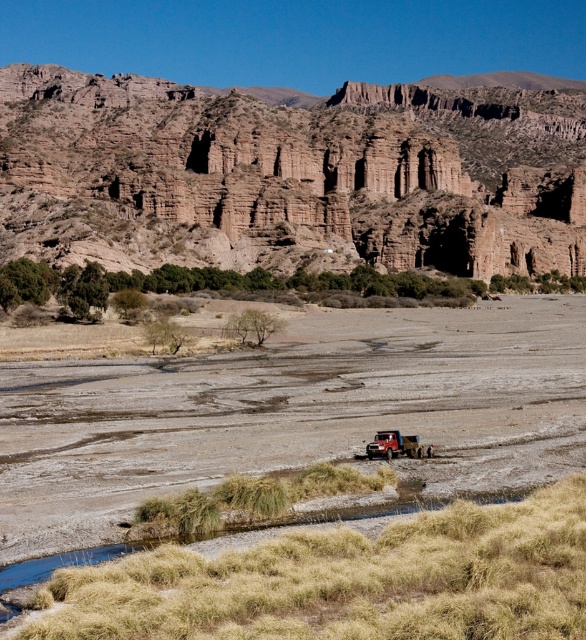
You are a hiker planning to cross the brown sandy dirt field at center. You notice the brown rock formation at upper center in the distance. Considering their sizes, which object would be more challenging to navigate and why?

The brown rock formation at upper center would be more challenging to navigate because it has a larger size compared to the brown sandy dirt field at center.

You are a delivery driver who needs to transport a 50 foot long cargo container from the brushed metal truck at center to the brown sandy dirt field at center. Can the cargo container fit between them without overlapping?

The distance between the brown sandy dirt field at center and the brushed metal truck at center is 60.69 feet. Since the cargo container is 50 feet long, it can fit within the space between them without overlapping.

You are planning a road trip and need to navigate through the arid landscape shown. Your vehicle is the brushed metal truck at center. There is a brown rock formation at upper center that you must pass. Can your truck safely maneuver around the rock formation without getting stuck?

The brown rock formation at upper center might be wider than the brushed metal truck at center, so there is a possibility that the truck can safely maneuver around it. However, since the exact width difference is uncertain, it would be prudent to proceed with caution and assess the space before attempting to pass.